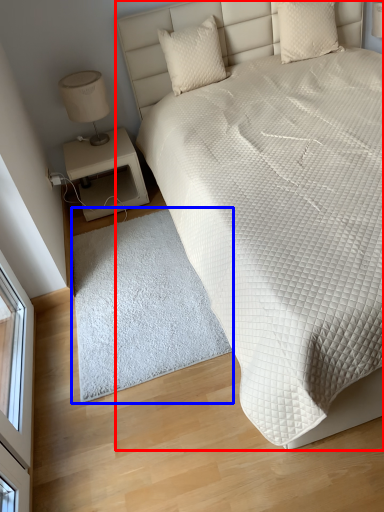
Question: Among these objects, which one is nearest to the camera, bed (highlighted by a red box) or mat (highlighted by a blue box)?

Choices:
 (A) bed
 (B) mat

Answer: (A)